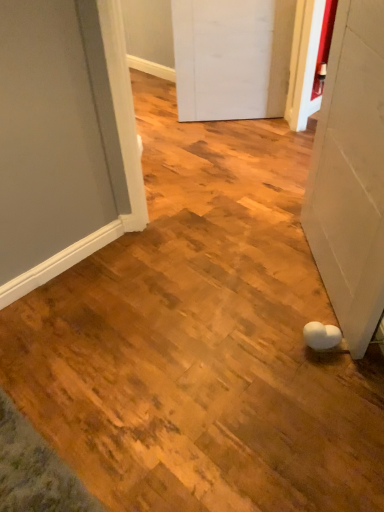
Question: Is white matte door at lower right, which is the second door from top to bottom, wider or thinner than white matte door at center, the first door when ordered from back to front?

Choices:
 (A) thin
 (B) wide

Answer: (B)

Question: From a real-world perspective, relative to white matte door at center, marked as the first door in a top-to-bottom arrangement, is white matte door at lower right, the 1th door from the front, vertically above or below?

Choices:
 (A) above
 (B) below

Answer: (A)

Question: From the image's perspective, is white matte door at lower right, acting as the first door starting from the bottom, positioned above or below white matte door at center, which is the 2th door in front-to-back order?

Choices:
 (A) below
 (B) above

Answer: (A)

Question: Considering the positions of white matte door at center, the first door when ordered from back to front, and white matte door at lower right, acting as the first door starting from the bottom, in the image, is white matte door at center, the first door when ordered from back to front, taller or shorter than white matte door at lower right, acting as the first door starting from the bottom,?

Choices:
 (A) short
 (B) tall

Answer: (A)

Question: In the image, is white matte door at center, marked as the first door in a top-to-bottom arrangement, on the left side or the right side of white matte door at lower right, acting as the first door starting from the bottom?

Choices:
 (A) right
 (B) left

Answer: (B)

Question: Is white matte door at center, the first door when ordered from back to front, situated inside white matte door at lower right, marked as the 2th door in a back-to-front arrangement, or outside?

Choices:
 (A) outside
 (B) inside

Answer: (A)

Question: Looking at their shapes, would you say white matte door at center, marked as the first door in a top-to-bottom arrangement, is wider or thinner than white matte door at lower right, acting as the first door starting from the bottom?

Choices:
 (A) thin
 (B) wide

Answer: (A)